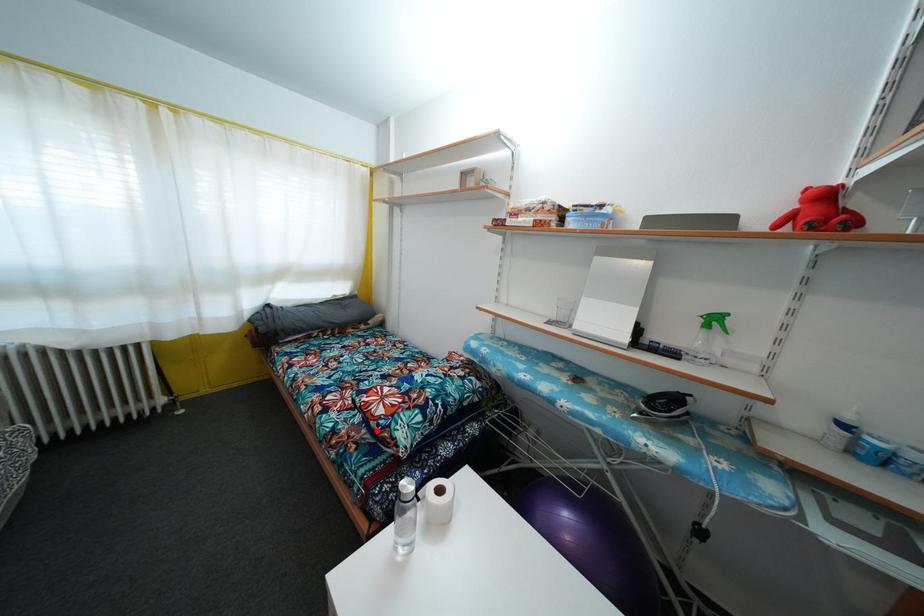
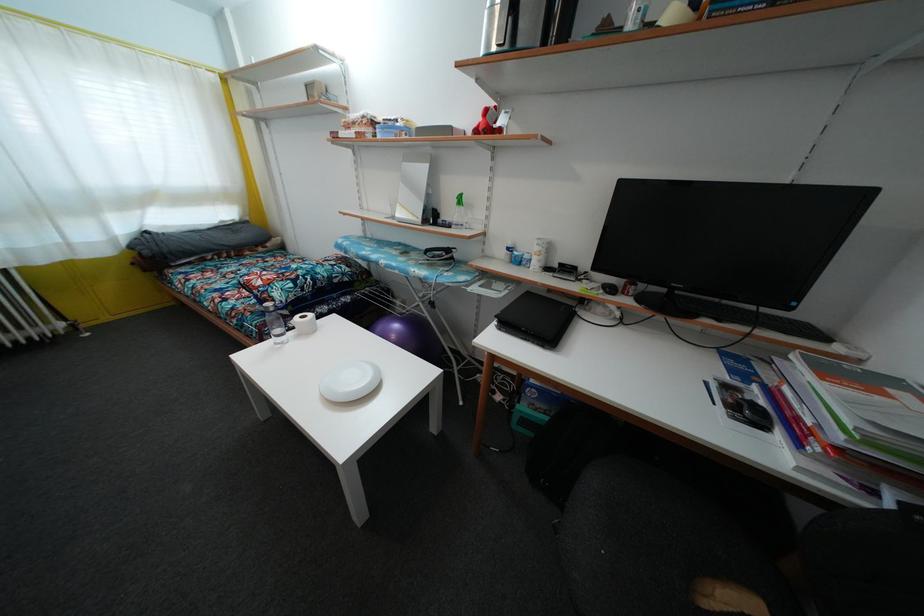
In the second image, find the point that corresponds to the highlighted location in the first image.

(259, 299)